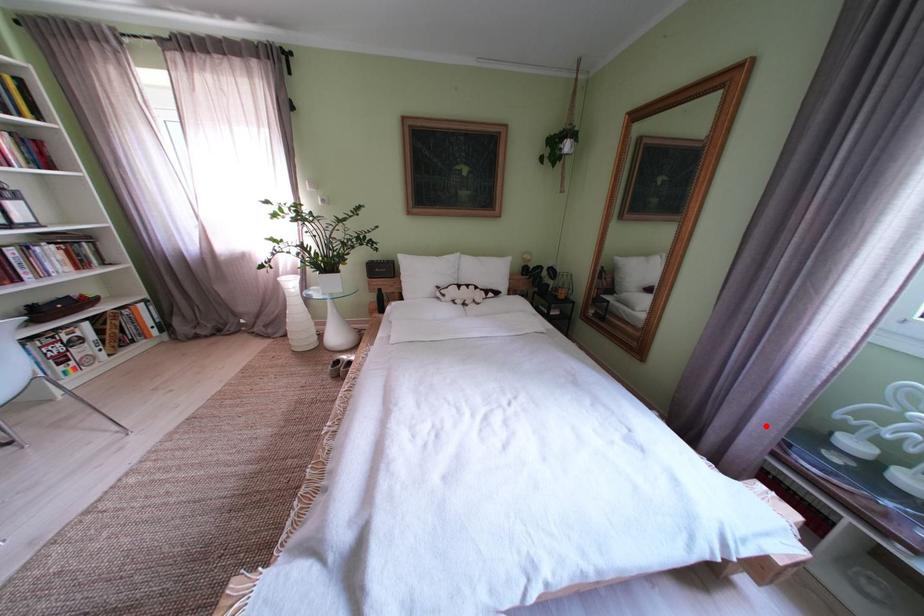
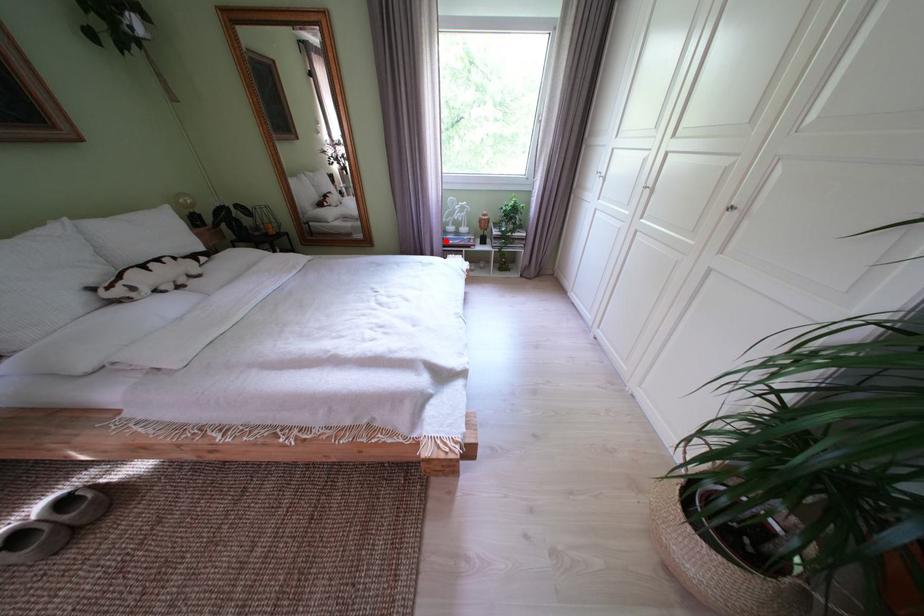
I am providing you with two images of the same scene from different viewpoints. A red point is marked on the first image and another point is marked on the second image. Does the point marked in image1 correspond to the same location as the one in image2?

Yes